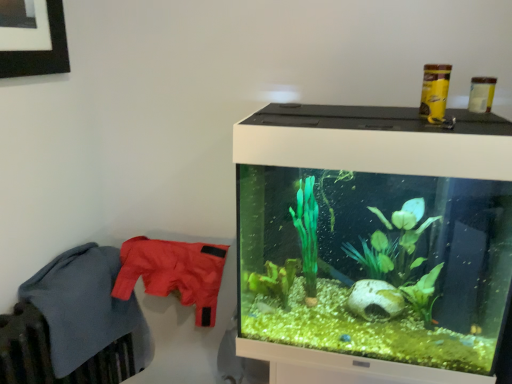
Question: Considering the relative sizes of matte nylon jacket at left, arranged as the second clothing when viewed from the left, and transparent glass aquarium at right in the image provided, is matte nylon jacket at left, arranged as the second clothing when viewed from the left, shorter than transparent glass aquarium at right?

Choices:
 (A) no
 (B) yes

Answer: (B)

Question: Can you confirm if matte nylon jacket at left, arranged as the second clothing when viewed from the left, is smaller than transparent glass aquarium at right?

Choices:
 (A) yes
 (B) no

Answer: (A)

Question: From a real-world perspective, is matte nylon jacket at left, marked as the first clothing in a right-to-left arrangement, below transparent glass aquarium at right?

Choices:
 (A) no
 (B) yes

Answer: (B)

Question: Does matte nylon jacket at left, arranged as the second clothing when viewed from the left, contain transparent glass aquarium at right?

Choices:
 (A) no
 (B) yes

Answer: (A)

Question: Is matte nylon jacket at left, arranged as the second clothing when viewed from the left, far from transparent glass aquarium at right?

Choices:
 (A) yes
 (B) no

Answer: (B)

Question: Is soft fleece blanket at left, positioned as the 2th clothing in right-to-left order, situated inside transparent glass aquarium at right or outside?

Choices:
 (A) outside
 (B) inside

Answer: (A)

Question: From the image's perspective, is soft fleece blanket at left, the 1th clothing in the left-to-right sequence, located above or below transparent glass aquarium at right?

Choices:
 (A) above
 (B) below

Answer: (B)

Question: In the image, is soft fleece blanket at left, positioned as the 2th clothing in right-to-left order, positioned in front of or behind transparent glass aquarium at right?

Choices:
 (A) behind
 (B) front

Answer: (A)

Question: Would you say soft fleece blanket at left, the 1th clothing in the left-to-right sequence, is to the left or to the right of transparent glass aquarium at right in the picture?

Choices:
 (A) right
 (B) left

Answer: (B)

Question: Considering the positions of matte nylon jacket at left, arranged as the second clothing when viewed from the left, and soft fleece blanket at left, the 1th clothing in the left-to-right sequence, in the image, is matte nylon jacket at left, arranged as the second clothing when viewed from the left, taller or shorter than soft fleece blanket at left, the 1th clothing in the left-to-right sequence,?

Choices:
 (A) short
 (B) tall

Answer: (A)

Question: From a real-world perspective, relative to soft fleece blanket at left, the 1th clothing in the left-to-right sequence, is matte nylon jacket at left, arranged as the second clothing when viewed from the left, vertically above or below?

Choices:
 (A) above
 (B) below

Answer: (A)

Question: From the image's perspective, is matte nylon jacket at left, arranged as the second clothing when viewed from the left, positioned above or below soft fleece blanket at left, the 1th clothing in the left-to-right sequence?

Choices:
 (A) above
 (B) below

Answer: (A)

Question: Would you say matte nylon jacket at left, arranged as the second clothing when viewed from the left, is to the left or to the right of soft fleece blanket at left, positioned as the 2th clothing in right-to-left order, in the picture?

Choices:
 (A) right
 (B) left

Answer: (A)

Question: In terms of width, does soft fleece blanket at left, positioned as the 2th clothing in right-to-left order, look wider or thinner when compared to matte nylon jacket at left, marked as the first clothing in a right-to-left arrangement?

Choices:
 (A) wide
 (B) thin

Answer: (B)

Question: Is soft fleece blanket at left, the 1th clothing in the left-to-right sequence, taller or shorter than matte nylon jacket at left, arranged as the second clothing when viewed from the left?

Choices:
 (A) tall
 (B) short

Answer: (A)